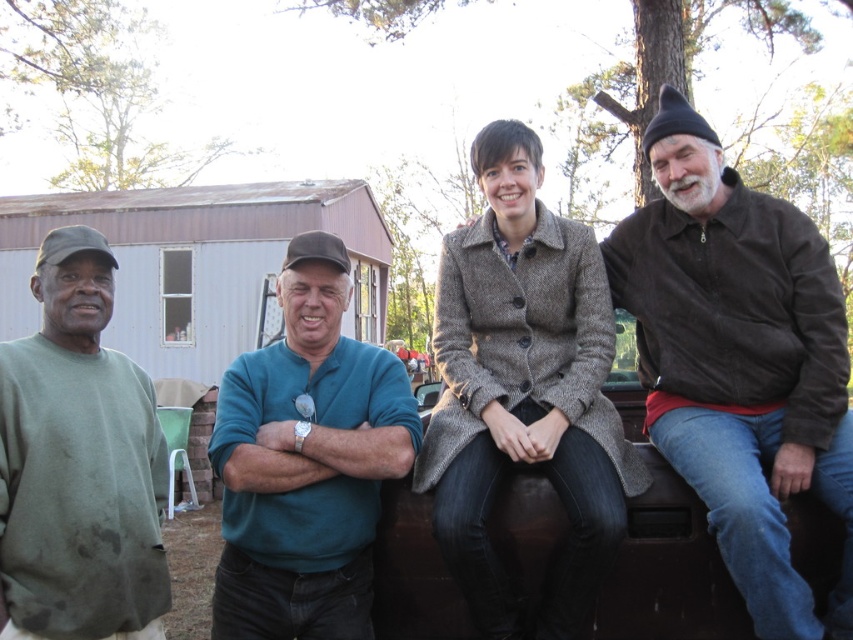
What is located at the coordinates point (524, 390) in the image?

A brown woolen coat at center is located at point (524, 390).

You are a photographer trying to capture a group photo of the people in front of the pickup truck. You need to ensure that both the brown woolen coat at center and the teal fabric shirt at center are clearly visible in the frame. Given their current positions, can you fit both into the photo without moving anyone?

The brown woolen coat at center and teal fabric shirt at center are 23.23 inches apart from each other. Since they are positioned close enough and centered, the photographer can easily capture both in the frame without needing to adjust their positions.

You are standing in front of the pickup truck and want to place a small flag exactly at the point closer to the camera between the two points marked as point (575, 305) and point (288, 376). Which point should you choose?

You should choose point (575, 305) because it is further to the camera than point (288, 376).